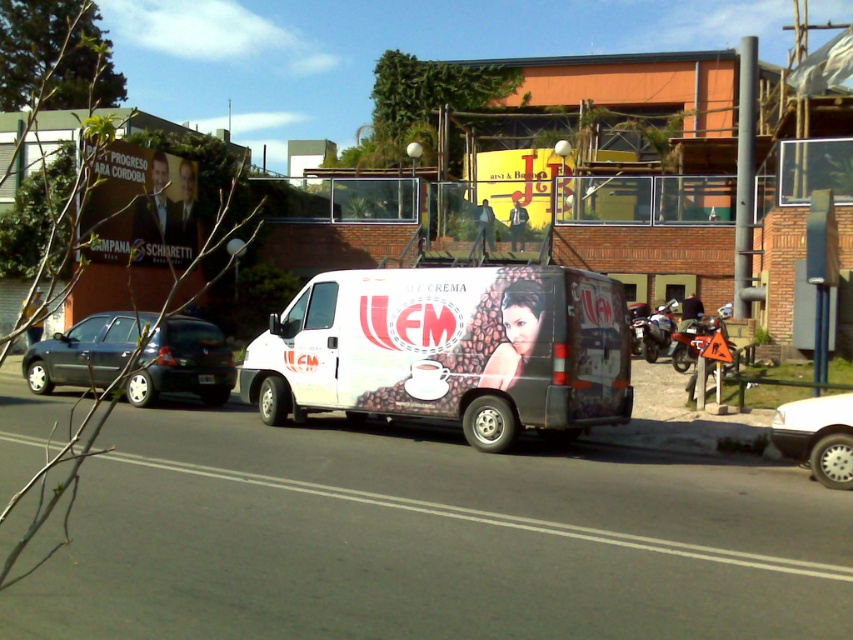
You are a delivery driver needing to park your car between the matte dark blue hatchback at left and the white matte car at lower right. Is there enough space for your car, which is 4.5 meters long?

The matte dark blue hatchback at left is to the left of the white matte car at lower right. However, the distance between them isn not specified in the objects description, so we cannot determine if there is enough space for a 4.5 meter car.